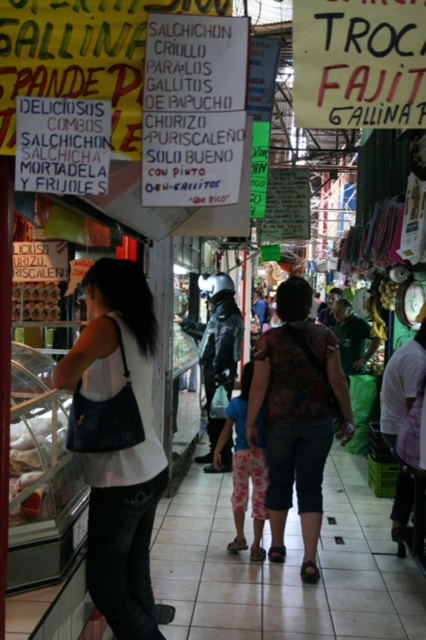
You are a tourist in this market and want to read the white paper sign at upper center and also check out the matte brown bread at left. Which object is higher up in the scene?

The white paper sign at upper center is above the matte brown bread at left, so it is higher up in the scene.

You are standing in the market and want to determine which of the two points, point (x=132, y=621) or point (x=419, y=92), is closer to you. Based on the scene, which point is nearer?

Point (x=132, y=621) is closer to you than point (x=419, y=92) because it is further to the viewer.

You are a customer at the market and want to buy both the matte black bag at left and the matte brown bread at left. However, you notice that one of them is too large to fit in your small handbag. Which item should you choose to take first?

The matte black bag at left is bigger than the matte brown bread at left, so you should choose the matte brown bread at left first since it is smaller and more likely to fit in your small handbag.